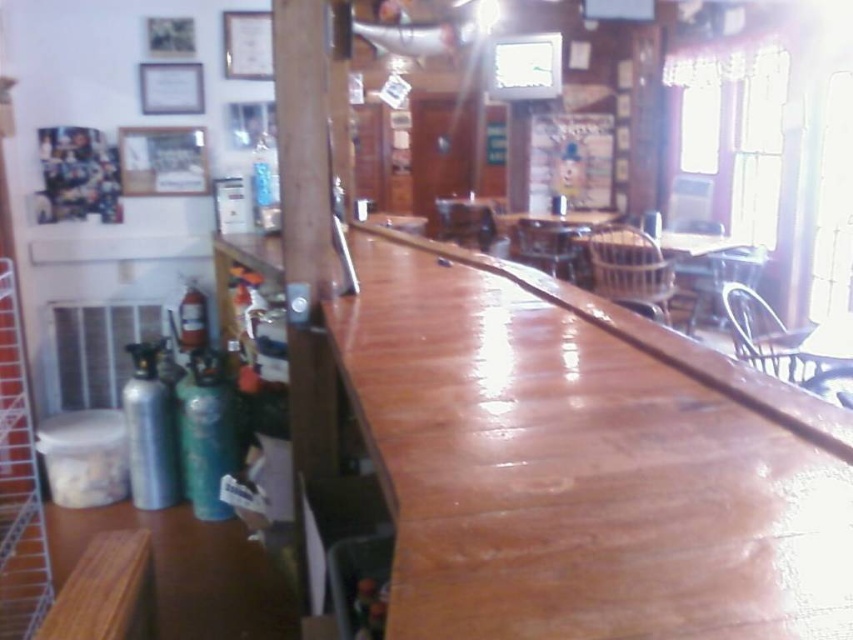
Question: Which point is farther to the camera?

Choices:
 (A) wooden table at center
 (B) clear glass bottle at center

Answer: (B)

Question: Which of the following is the farthest from the observer?

Choices:
 (A) click(432, 508)
 (B) click(160, 456)
 (C) click(218, 506)

Answer: (B)

Question: Does clear glass bottle at center appear on the right side of red glass fire extinguisher at left?

Choices:
 (A) yes
 (B) no

Answer: (A)

Question: Is wooden table at center thinner than green matte gas canister at lower left?

Choices:
 (A) yes
 (B) no

Answer: (B)

Question: Can you confirm if wooden table at center is positioned to the right of wooden plank at lower left?

Choices:
 (A) no
 (B) yes

Answer: (B)

Question: Which object is positioned closest to the metallic green gas canister at left?

Choices:
 (A) red glass fire extinguisher at left
 (B) wooden table at center
 (C) green matte gas canister at lower left

Answer: (C)